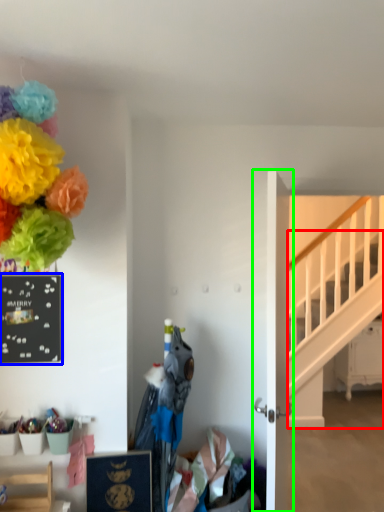
Question: Based on their relative distances, which object is farther from stairs (highlighted by a red box)? Choose from bulletin board (highlighted by a blue box) and door (highlighted by a green box).

Choices:
 (A) bulletin board
 (B) door

Answer: (A)